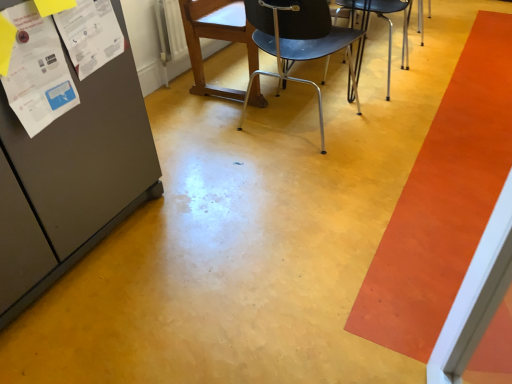
Question: Is metallic black chair at center, the first chair when ordered from right to left, located within metallic silver chair at center, acting as the 2th chair starting from the right?

Choices:
 (A) yes
 (B) no

Answer: (B)

Question: Considering the relative sizes of metallic silver chair at center, acting as the 2th chair starting from the right, and metallic black chair at center, the first chair when ordered from right to left, in the image provided, is metallic silver chair at center, acting as the 2th chair starting from the right, shorter than metallic black chair at center, the first chair when ordered from right to left,?

Choices:
 (A) yes
 (B) no

Answer: (B)

Question: From the image's perspective, does metallic silver chair at center, the 2th chair when ordered from left to right, appear lower than metallic black chair at center, the first chair when ordered from right to left?

Choices:
 (A) no
 (B) yes

Answer: (B)

Question: Is metallic silver chair at center, acting as the 2th chair starting from the right, touching metallic black chair at center, positioned as the third chair in left-to-right order?

Choices:
 (A) yes
 (B) no

Answer: (B)

Question: Does metallic silver chair at center, the 2th chair when ordered from left to right, have a smaller size compared to metallic black chair at center, the first chair when ordered from right to left?

Choices:
 (A) no
 (B) yes

Answer: (A)

Question: Do you think metallic black chair at center, positioned as the third chair in left-to-right order, is within orange smooth carpet at right, or outside of it?

Choices:
 (A) inside
 (B) outside

Answer: (B)

Question: From a real-world perspective, is metallic black chair at center, the first chair when ordered from right to left, above or below orange smooth carpet at right?

Choices:
 (A) below
 (B) above

Answer: (B)

Question: Does point (404, 3) appear closer or farther from the camera than point (492, 86)?

Choices:
 (A) farther
 (B) closer

Answer: (B)

Question: Looking at their shapes, would you say metallic black chair at center, the first chair when ordered from right to left, is wider or thinner than orange smooth carpet at right?

Choices:
 (A) wide
 (B) thin

Answer: (B)

Question: In terms of height, does orange smooth carpet at right look taller or shorter compared to metallic black chair at center, the first chair when ordered from right to left?

Choices:
 (A) short
 (B) tall

Answer: (A)

Question: From the image's perspective, is orange smooth carpet at right positioned above or below metallic black chair at center, the first chair when ordered from right to left?

Choices:
 (A) below
 (B) above

Answer: (A)

Question: Is orange smooth carpet at right to the left or to the right of metallic black chair at center, positioned as the third chair in left-to-right order, in the image?

Choices:
 (A) right
 (B) left

Answer: (A)

Question: Is orange smooth carpet at right inside or outside of metallic black chair at center, the first chair when ordered from right to left?

Choices:
 (A) inside
 (B) outside

Answer: (B)

Question: Based on their sizes in the image, would you say white paper at upper left, positioned as the first poster in right-to-left order, is bigger or smaller than metallic silver chair at center, acting as the 2th chair starting from the right?

Choices:
 (A) big
 (B) small

Answer: (B)

Question: Looking at their shapes, would you say white paper at upper left, which is the 2th poster from left to right, is wider or thinner than metallic silver chair at center, the 2th chair when ordered from left to right?

Choices:
 (A) wide
 (B) thin

Answer: (B)